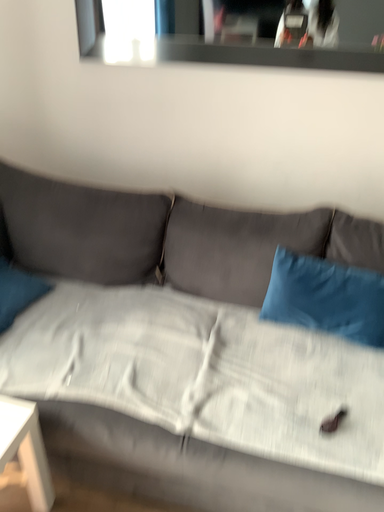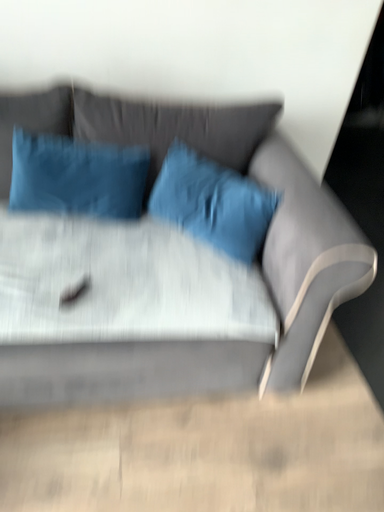
Question: Which way did the camera rotate in the video?

Choices:
 (A) rotated right
 (B) rotated left

Answer: (A)